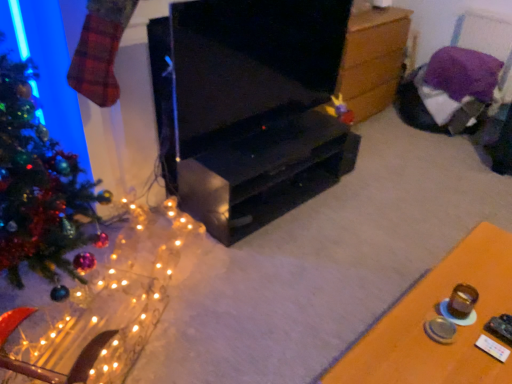
The height and width of the screenshot is (384, 512). Identify the location of blank space situated above black matte tv cabinet at center (from a real-world perspective). (274, 133).